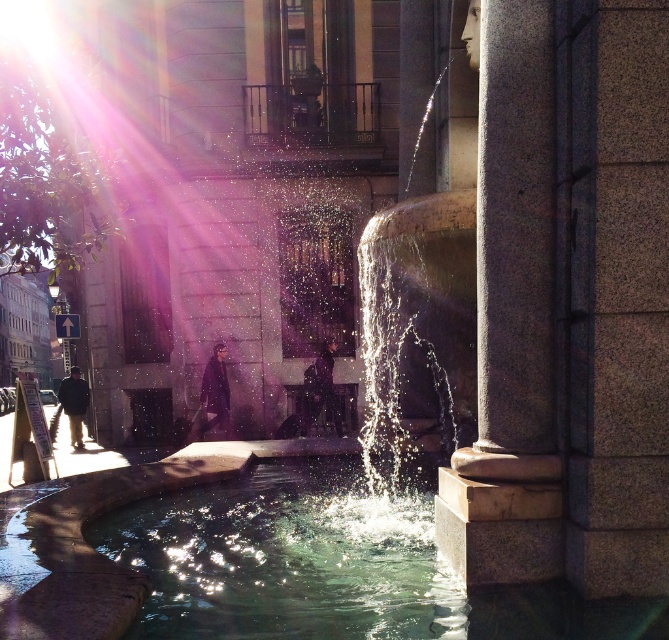
Question: Can you confirm if granite column at center is thinner than clear glass water at center?

Choices:
 (A) no
 (B) yes

Answer: (B)

Question: Does granite column at center have a lesser width compared to clear glass water at center?

Choices:
 (A) yes
 (B) no

Answer: (A)

Question: Is granite column at center positioned behind clear glass water at center?

Choices:
 (A) no
 (B) yes

Answer: (A)

Question: Which point is farther to the camera?

Choices:
 (A) clear glass water at center
 (B) granite column at center

Answer: (A)

Question: Which point is farther from the camera taking this photo?

Choices:
 (A) (488, 198)
 (B) (41, 596)

Answer: (A)